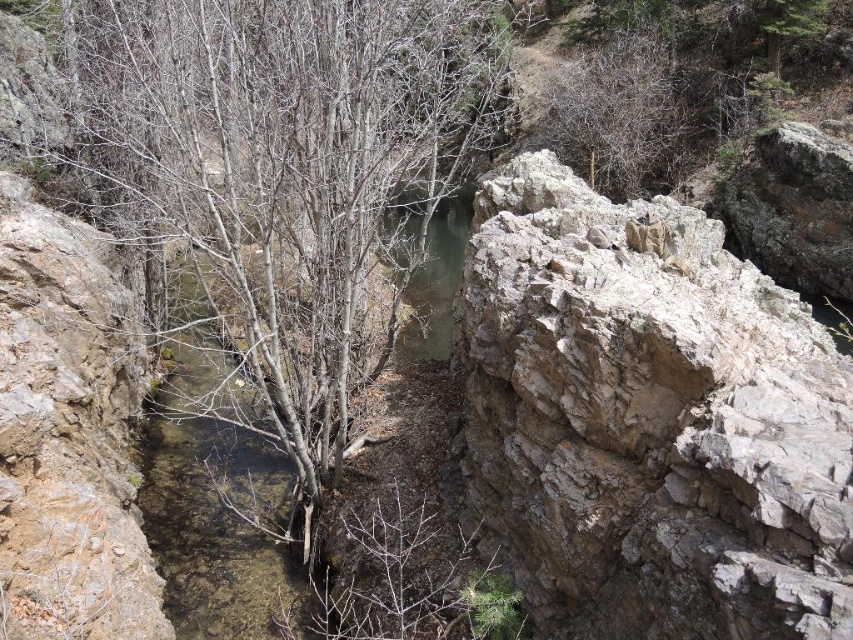
Between gray rough rock at center right and smooth bark tree at center, which one is positioned lower?

gray rough rock at center right

Does gray rough rock at center right appear on the left side of smooth bark tree at center?

In fact, gray rough rock at center right is to the right of smooth bark tree at center.

You are a GUI agent. You are given a task and a screenshot of the screen. Output one action in this format:
    pyautogui.click(x=<x>, y=<y>)
    Task: Click on the gray rough rock at center right
    
    Given the screenshot: What is the action you would take?
    pyautogui.click(x=648, y=422)

Identify the location of gray rough rock at center right. (648, 422).

Which is in front, point (97, 52) or point (149, 528)?

Point (149, 528)

Is point (416, 250) positioned in front of point (161, 461)?

No.

What do you see at coordinates (287, 168) in the screenshot?
I see `smooth bark tree at center` at bounding box center [287, 168].

Image resolution: width=853 pixels, height=640 pixels. In order to click on smooth bark tree at center in this screenshot , I will do `click(287, 168)`.

From the picture: Is gray rough rock at center right shorter than clear water at center?

Yes.

Does gray rough rock at center right have a greater height compared to clear water at center?

No.

Who is more forward, (598, 532) or (223, 374)?

Positioned in front is point (598, 532).

The width and height of the screenshot is (853, 640). I want to click on gray rough rock at center right, so click(648, 422).